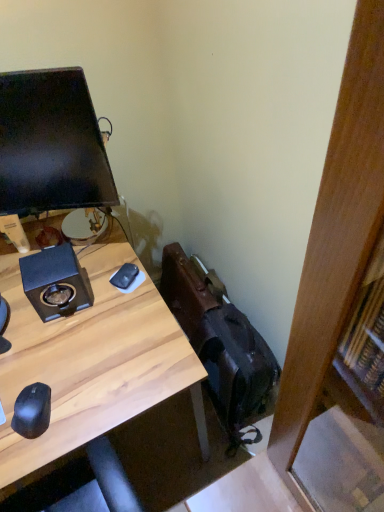
This screenshot has height=512, width=384. In order to click on free space to the back side of black matte speaker at upper left in this screenshot , I will do pyautogui.click(x=92, y=252).